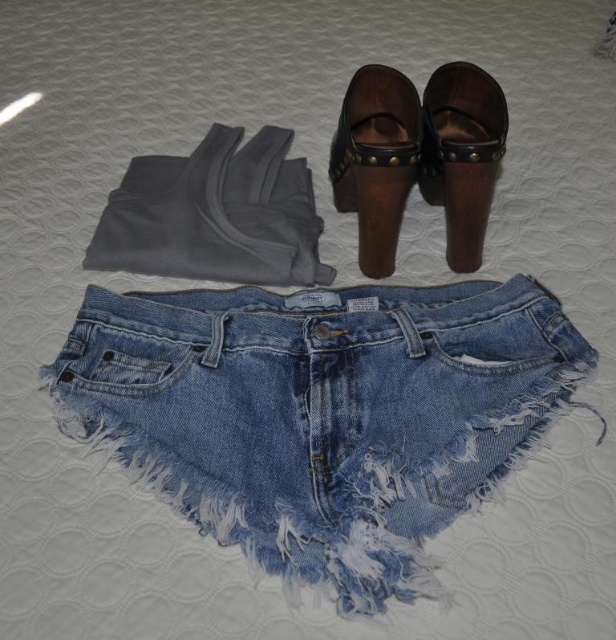
Question: Does gray fleece pants at upper left appear over brown leather sandal at upper center?

Choices:
 (A) no
 (B) yes

Answer: (A)

Question: Is faded denim shorts at center positioned behind brown leather clog at upper center?

Choices:
 (A) no
 (B) yes

Answer: (A)

Question: Estimate the real-world distances between objects in this image. Which object is closer to the brown leather clog at upper center?

Choices:
 (A) brown leather sandal at upper center
 (B) faded denim shorts at center

Answer: (A)

Question: Which is nearer to the brown leather clog at upper center?

Choices:
 (A) brown leather sandal at upper center
 (B) faded denim shorts at center
 (C) gray fleece pants at upper left

Answer: (A)

Question: Does faded denim shorts at center appear on the left side of gray fleece pants at upper left?

Choices:
 (A) no
 (B) yes

Answer: (A)

Question: Which object appears farthest from the camera in this image?

Choices:
 (A) brown leather clog at upper center
 (B) gray fleece pants at upper left
 (C) brown leather sandal at upper center
 (D) faded denim shorts at center

Answer: (B)